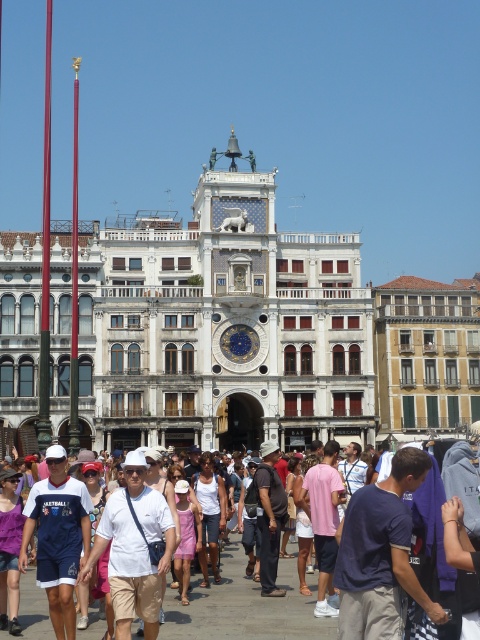
Where is `white cotton crowd at center`? The image size is (480, 640). white cotton crowd at center is located at coordinates (244, 605).

Which of these two, white cotton crowd at center or white cotton shirt at center, stands taller?

Standing taller between the two is white cotton shirt at center.

Is point (180, 614) positioned in front of point (123, 625)?

That is False.

You are a GUI agent. You are given a task and a screenshot of the screen. Output one action in this format:
    pyautogui.click(x=<x>, y=<y>)
    Task: Click on the white cotton crowd at center
    Image resolution: width=480 pixels, height=640 pixels.
    Given the screenshot: What is the action you would take?
    pyautogui.click(x=244, y=605)

The width and height of the screenshot is (480, 640). What do you see at coordinates (133, 548) in the screenshot?
I see `white cotton shirt at center` at bounding box center [133, 548].

Does white cotton shirt at center have a larger size compared to white cotton tank top at center?

Yes, white cotton shirt at center is bigger than white cotton tank top at center.

This screenshot has width=480, height=640. Find the location of `white cotton shirt at center`. white cotton shirt at center is located at coordinates (133, 548).

Does pink cotton shirt at center have a lesser height compared to white cotton tank top at center?

Incorrect, pink cotton shirt at center's height does not fall short of white cotton tank top at center's.

I want to click on pink cotton shirt at center, so click(x=324, y=522).